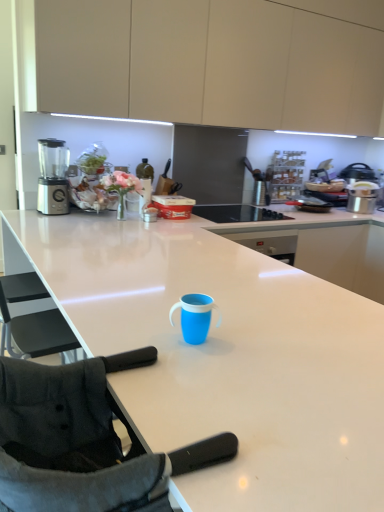
The image size is (384, 512). Find the location of `free space between satin silver blender at left and blue plastic sippy cup at center`. free space between satin silver blender at left and blue plastic sippy cup at center is located at coordinates (98, 258).